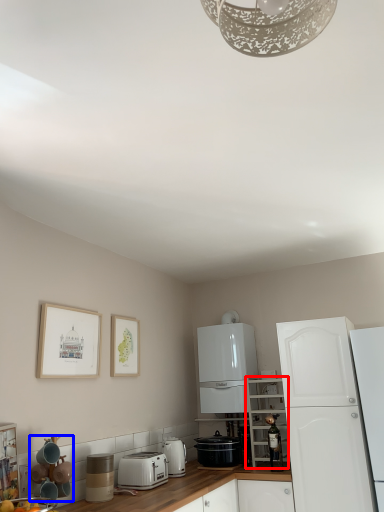
Question: Which point is closer to the camera, cabinetry (highlighted by a red box) or appliance (highlighted by a blue box)?

Choices:
 (A) cabinetry
 (B) appliance

Answer: (B)